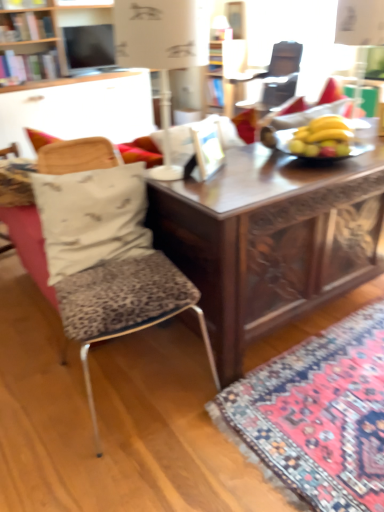
Question: Should I look upward or downward to see carpet with intricate patterns at lower right?

Choices:
 (A) up
 (B) down

Answer: (B)

Question: From the image's perspective, is white fabric pillow at left below yellow matte bananas at center?

Choices:
 (A) no
 (B) yes

Answer: (B)

Question: From the image's perspective, is white fabric pillow at left over yellow matte bananas at center?

Choices:
 (A) no
 (B) yes

Answer: (A)

Question: Is white fabric pillow at left not within yellow matte bananas at center?

Choices:
 (A) yes
 (B) no

Answer: (A)

Question: Is white fabric pillow at left smaller than yellow matte bananas at center?

Choices:
 (A) yes
 (B) no

Answer: (B)

Question: Is white fabric pillow at left further to camera compared to yellow matte bananas at center?

Choices:
 (A) yes
 (B) no

Answer: (B)

Question: Considering the relative sizes of white fabric pillow at left and yellow matte bananas at center in the image provided, is white fabric pillow at left taller than yellow matte bananas at center?

Choices:
 (A) no
 (B) yes

Answer: (B)

Question: Is white paper lampshade at upper center completely or partially inside carpet with intricate patterns at lower right?

Choices:
 (A) no
 (B) yes

Answer: (A)

Question: Considering the relative sizes of carpet with intricate patterns at lower right and white paper lampshade at upper center in the image provided, is carpet with intricate patterns at lower right thinner than white paper lampshade at upper center?

Choices:
 (A) no
 (B) yes

Answer: (A)

Question: From the image's perspective, is carpet with intricate patterns at lower right over white paper lampshade at upper center?

Choices:
 (A) yes
 (B) no

Answer: (B)

Question: From a real-world perspective, does carpet with intricate patterns at lower right stand above white paper lampshade at upper center?

Choices:
 (A) yes
 (B) no

Answer: (B)

Question: Is carpet with intricate patterns at lower right to the left of white paper lampshade at upper center from the viewer's perspective?

Choices:
 (A) no
 (B) yes

Answer: (A)

Question: Can you confirm if carpet with intricate patterns at lower right is taller than white paper lampshade at upper center?

Choices:
 (A) yes
 (B) no

Answer: (B)

Question: Can you confirm if matte black television at upper center is shorter than yellow matte bananas at center?

Choices:
 (A) yes
 (B) no

Answer: (B)